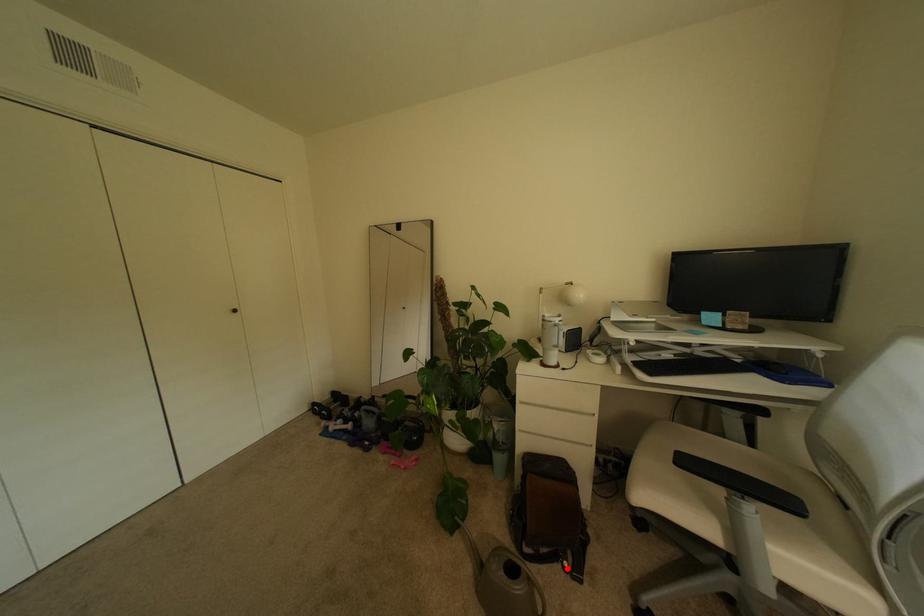
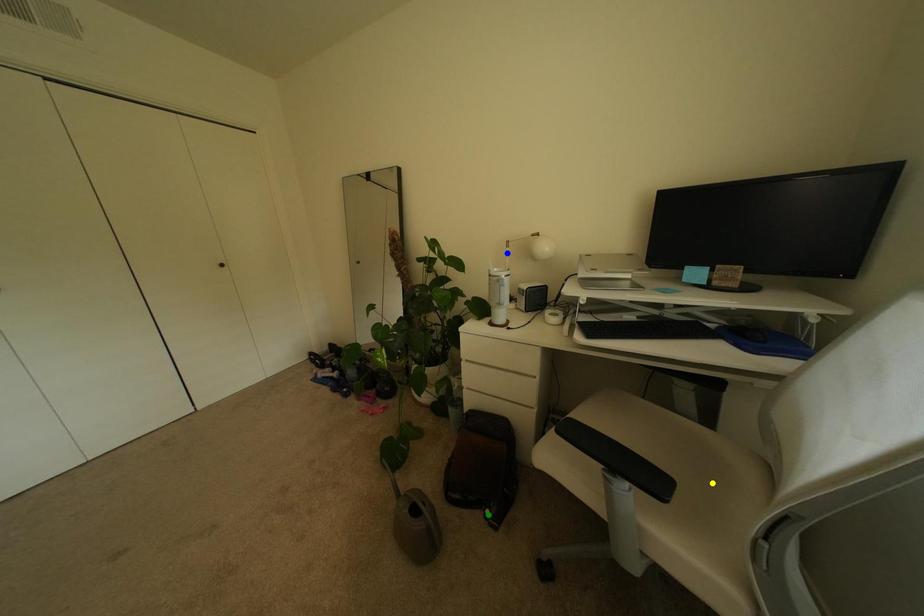
Question: I am providing you with two images of the same scene from different viewpoints. A red point is marked on the first image. You are given multiple points on the second image. Which point in image 2 is actually the same real-world point as the red point in image 1?

Choices:
 (A) yellow point
 (B) blue point
 (C) green point

Answer: (C)